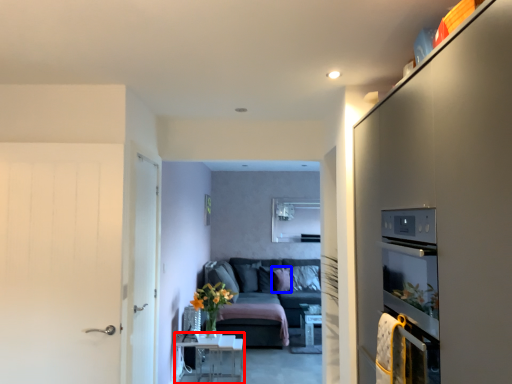
Question: Which of the following is the closest to the observer, table (highlighted by a red box) or pillow (highlighted by a blue box)?

Choices:
 (A) table
 (B) pillow

Answer: (A)